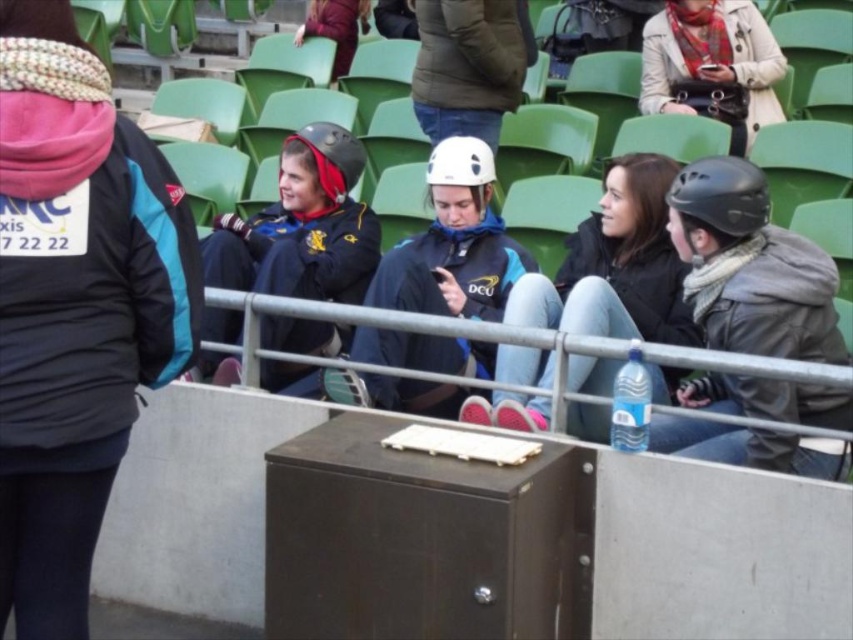
Is point (86, 490) more distant than point (521, 403)?

No, it is not.

Between matte black jacket at center and matte black helmet at center, which one has less height?

matte black helmet at center

At what (x,y) coordinates should I click in order to perform the action: click on matte black jacket at center. Please return your answer as a coordinate pair (x, y). Looking at the image, I should click on (74, 307).

Locate an element on the screen. matte black jacket at center is located at coordinates click(74, 307).

This screenshot has width=853, height=640. What do you see at coordinates (74, 307) in the screenshot?
I see `matte black jacket at center` at bounding box center [74, 307].

Does matte black jacket at center have a greater height compared to plaid scarf at upper right?

Yes, matte black jacket at center is taller than plaid scarf at upper right.

Is point (50, 35) farther from camera compared to point (740, 113)?

No, it is in front of (740, 113).

Find the location of a particular element. The height and width of the screenshot is (640, 853). matte black jacket at center is located at coordinates (74, 307).

Can you confirm if matte black helmet at left is thinner than white matte helmet at center?

Indeed, matte black helmet at left has a lesser width compared to white matte helmet at center.

Is point (213, 364) positioned in front of point (489, 353)?

No, (213, 364) is further to viewer.

Find the location of a particular element. matte black helmet at left is located at coordinates (300, 227).